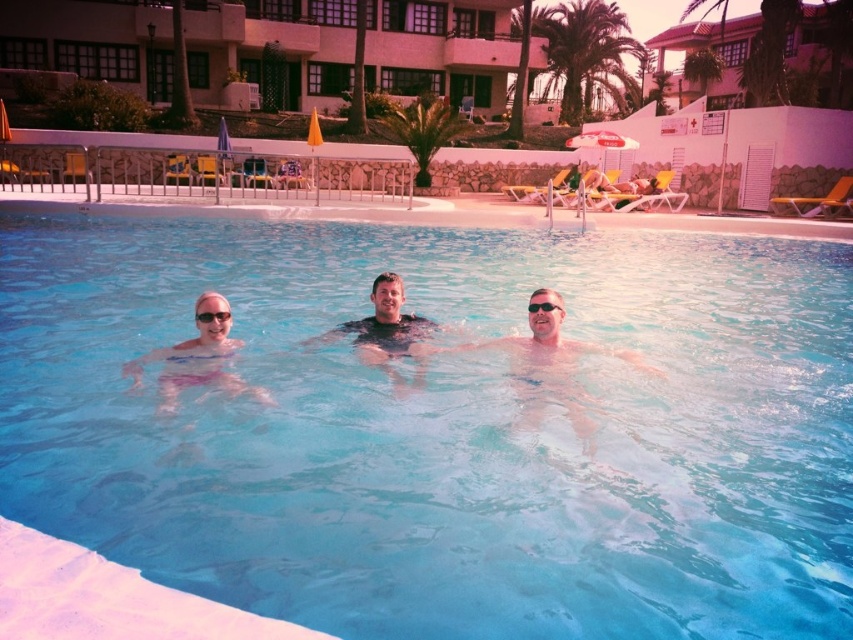
Question: Considering the real-world distances, which object is farthest from the transparent blue water at center?

Choices:
 (A) pink fabric at center
 (B) black plastic goggles at center
 (C) smooth black swimwear at center

Answer: (B)

Question: Which object is closer to the camera taking this photo?

Choices:
 (A) pink fabric at center
 (B) green leafy palm tree at upper center
 (C) clear plastic goggles at center

Answer: (A)

Question: Is pink fabric at center to the right of clear plastic goggles at center from the viewer's perspective?

Choices:
 (A) yes
 (B) no

Answer: (B)

Question: Which object is farther from the camera taking this photo?

Choices:
 (A) smooth black swimwear at center
 (B) pink fabric at center
 (C) clear plastic goggles at center

Answer: (A)

Question: In this image, where is green leafy palm tree at upper center located relative to black plastic goggles at center?

Choices:
 (A) below
 (B) above

Answer: (B)

Question: In this image, where is green leafy palm tree at upper center located relative to smooth black swimwear at center?

Choices:
 (A) below
 (B) above

Answer: (B)